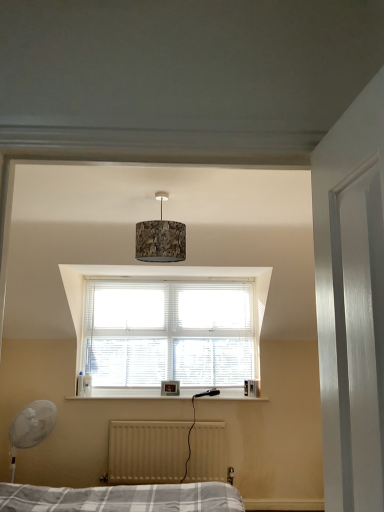
Question: Considering the relative sizes of white plastic fan at lower left and white matte radiator at lower center in the image provided, is white plastic fan at lower left taller than white matte radiator at lower center?

Choices:
 (A) yes
 (B) no

Answer: (A)

Question: Is white plastic fan at lower left oriented away from white matte radiator at lower center?

Choices:
 (A) yes
 (B) no

Answer: (B)

Question: Could you tell me if white plastic fan at lower left is facing white matte radiator at lower center?

Choices:
 (A) yes
 (B) no

Answer: (B)

Question: Considering the relative positions of white plastic fan at lower left and white matte radiator at lower center in the image provided, is white plastic fan at lower left to the left of white matte radiator at lower center from the viewer's perspective?

Choices:
 (A) yes
 (B) no

Answer: (A)

Question: Is white plastic fan at lower left closer to the viewer compared to white matte radiator at lower center?

Choices:
 (A) no
 (B) yes

Answer: (B)

Question: From the image's perspective, would you say white plastic fan at lower left is shown under white matte radiator at lower center?

Choices:
 (A) no
 (B) yes

Answer: (A)

Question: From the image's perspective, is white matte radiator at lower center above white plastic fan at lower left?

Choices:
 (A) yes
 (B) no

Answer: (B)

Question: Can you confirm if white matte radiator at lower center is thinner than white plastic fan at lower left?

Choices:
 (A) no
 (B) yes

Answer: (B)

Question: Can we say white matte radiator at lower center lies outside white plastic fan at lower left?

Choices:
 (A) yes
 (B) no

Answer: (A)

Question: Can you confirm if white matte radiator at lower center is positioned to the right of white plastic fan at lower left?

Choices:
 (A) yes
 (B) no

Answer: (A)

Question: Can you confirm if white matte radiator at lower center is wider than white plastic fan at lower left?

Choices:
 (A) no
 (B) yes

Answer: (A)

Question: From a real-world perspective, is white matte radiator at lower center located beneath white plastic fan at lower left?

Choices:
 (A) yes
 (B) no

Answer: (A)

Question: Considering the relative sizes of textured cork lampshade at center and white plastic fan at lower left in the image provided, is textured cork lampshade at center smaller than white plastic fan at lower left?

Choices:
 (A) no
 (B) yes

Answer: (B)